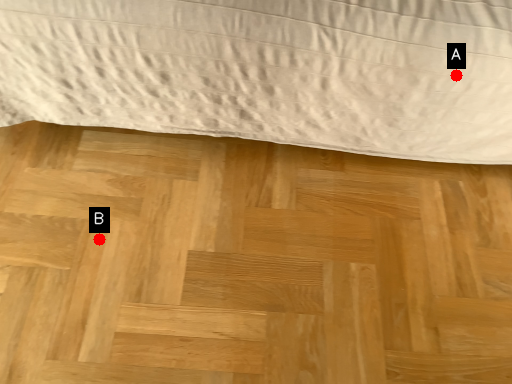
Question: Two points are circled on the image, labeled by A and B beside each circle. Which point appears closest to the camera in this image?

Choices:
 (A) A is closer
 (B) B is closer

Answer: (A)